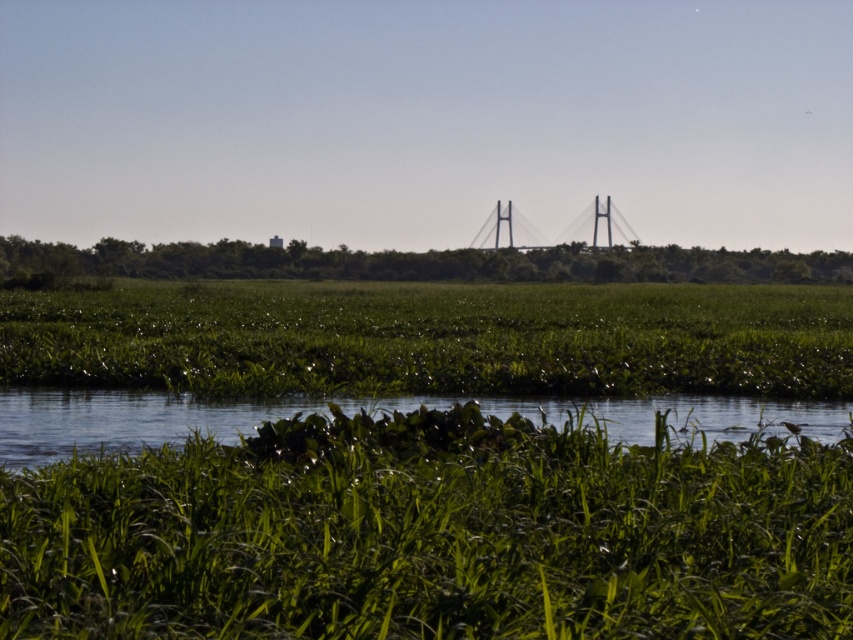
Question: Which object appears closest to the camera in this image?

Choices:
 (A) green grassy field at upper center
 (B) clear water at center
 (C) green leafy grass at lower center

Answer: (C)

Question: Is green leafy grass at lower center thinner than green leafy grass at center?

Choices:
 (A) no
 (B) yes

Answer: (B)

Question: Is green leafy grass at lower center bigger than metallic gray suspension bridge at center?

Choices:
 (A) no
 (B) yes

Answer: (A)

Question: Can you confirm if green leafy grass at center is positioned below metallic gray suspension bridge at center?

Choices:
 (A) yes
 (B) no

Answer: (A)

Question: Which of these objects is positioned farthest from the green leafy grass at center?

Choices:
 (A) green leafy grass at lower center
 (B) metallic gray suspension bridge at center
 (C) clear water at center
 (D) green grassy field at upper center

Answer: (B)

Question: Which is farther from the metallic gray suspension bridge at center?

Choices:
 (A) green leafy grass at lower center
 (B) clear water at center

Answer: (A)